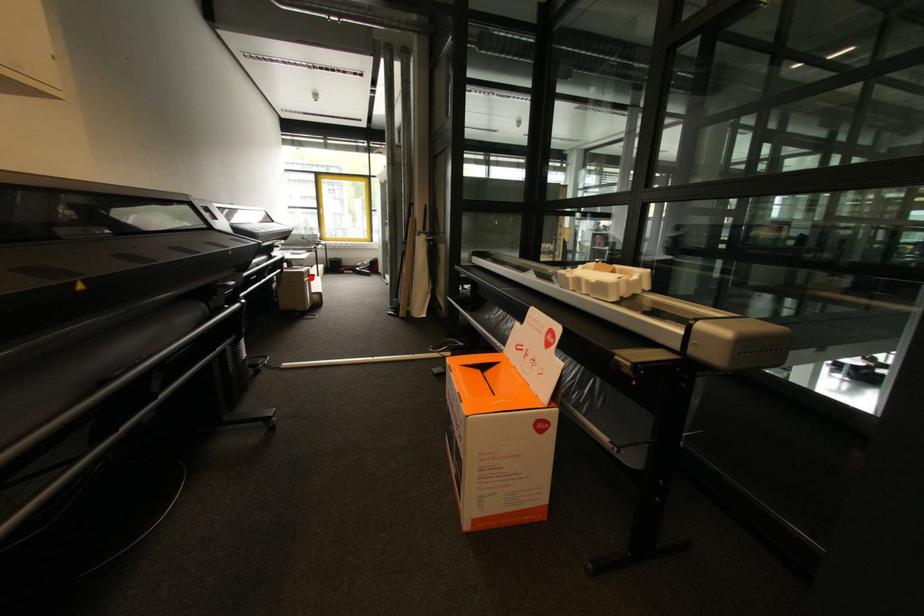
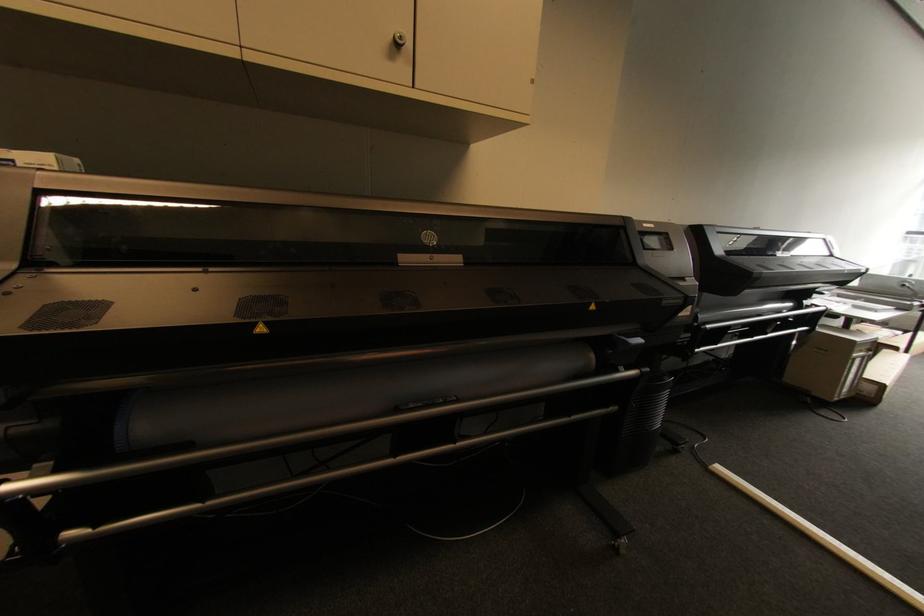
Find the pixel in the second image that matches the highlighted location in the first image.

(867, 352)